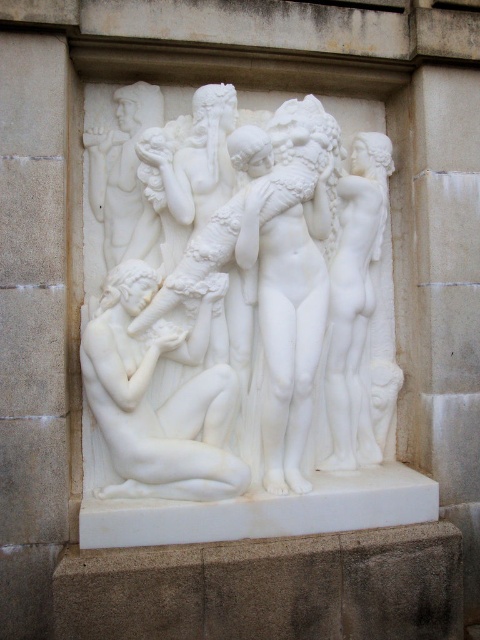
Question: Estimate the real-world distances between objects in this image. Which object is farther from the white marble nude at lower left?

Choices:
 (A) white marble nude at center
 (B) white marble goddess at center

Answer: (A)

Question: Is white marble goddess at center to the right of white marble nude at center from the viewer's perspective?

Choices:
 (A) yes
 (B) no

Answer: (B)

Question: Which of the following is the closest to the observer?

Choices:
 (A) white marble nude at center
 (B) white marble sculpture at center
 (C) white marble nude at lower left

Answer: (C)

Question: Does white marble nude at lower left have a greater width compared to white marble goddess at center?

Choices:
 (A) no
 (B) yes

Answer: (B)

Question: Which point is farther to the camera?

Choices:
 (A) (116, 371)
 (B) (142, 276)
 (C) (356, 186)
 (D) (282, 384)

Answer: (C)

Question: Can you confirm if white marble sculpture at center is smaller than white marble nude at center?

Choices:
 (A) yes
 (B) no

Answer: (B)